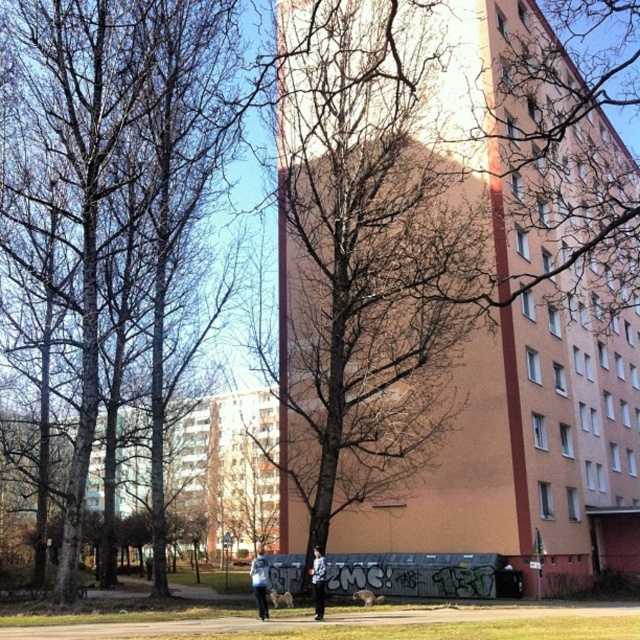
Question: Among these points, which one is nearest to the camera?

Choices:
 (A) (36, 131)
 (B) (257, 595)
 (C) (323, 561)

Answer: (B)

Question: Among these points, which one is farthest from the camera?

Choices:
 (A) (262, 605)
 (B) (72, 228)
 (C) (310, 570)

Answer: (B)

Question: Which of the following is the closest to the observer?

Choices:
 (A) light blue denim jacket at lower center
 (B) bare branches at left
 (C) light blue fabric jacket at lower center
 (D) orange matte building at center

Answer: (D)

Question: Is bare branches at left thinner than light blue fabric jacket at lower center?

Choices:
 (A) no
 (B) yes

Answer: (A)

Question: Does light blue fabric jacket at lower center have a greater width compared to light blue denim jacket at lower center?

Choices:
 (A) no
 (B) yes

Answer: (B)

Question: Is bare branches at left closer to the viewer compared to light blue denim jacket at lower center?

Choices:
 (A) no
 (B) yes

Answer: (B)